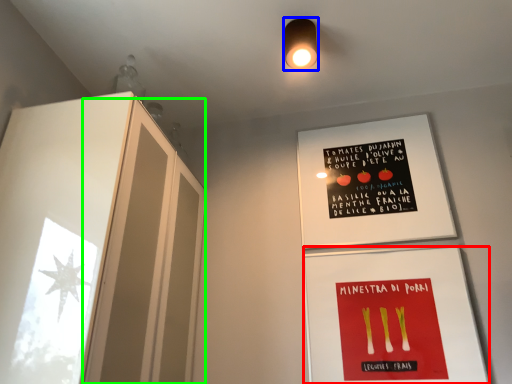
Question: Which is nearer to the flyer (highlighted by a red box)? light fixture (highlighted by a blue box) or glass door (highlighted by a green box).

Choices:
 (A) light fixture
 (B) glass door

Answer: (B)